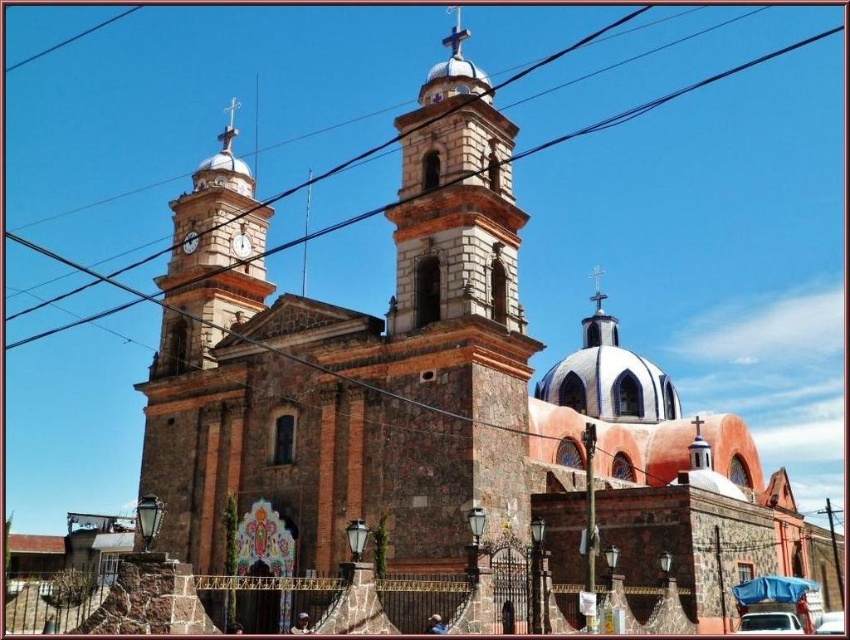
You are standing at the camera position and want to take a photo of the white matte car at lower right. The camera has a maximum zoom range of 180 feet. Can you capture the car without moving closer?

The white matte car at lower right and camera are 190.37 feet apart from each other. Since the maximum zoom is 180 feet, you cannot capture the car without moving closer.

You are a photographer standing in front of the church. You want to capture a photo that includes both the white stone bell tower at center and the white plastic car at lower right. Which object will appear taller in the photo?

The white stone bell tower at center will appear taller in the photo because it has a greater height compared to the white plastic car at lower right.

You are a visitor standing in front of the grand church with two towers. You notice a white matte car at lower right and a matte white clock at upper center. Which object is taller?

The matte white clock at upper center is taller than the white matte car at lower right.